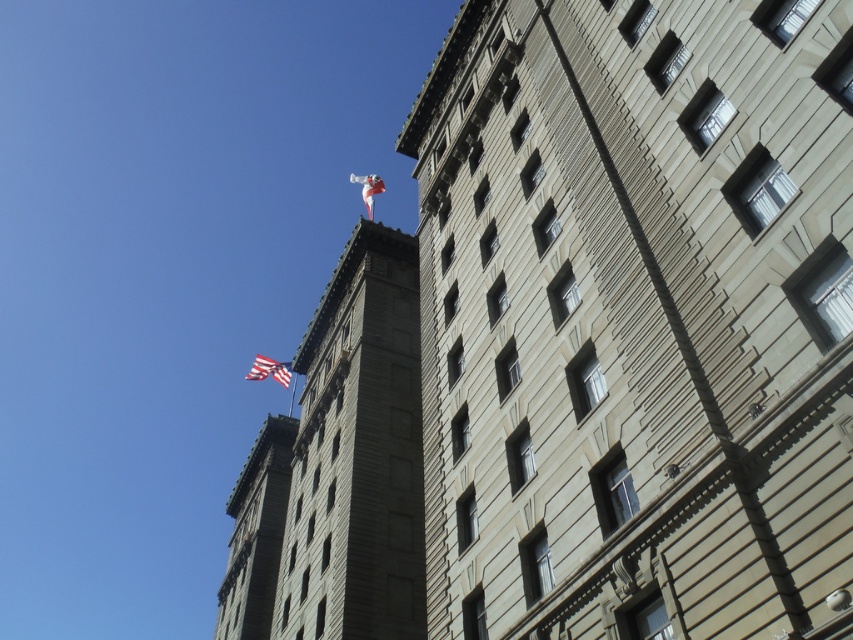
Question: Considering the real-world distances, which object is farthest from the red flag at upper left?

Choices:
 (A) white fabric flag at upper center
 (B) american flag at upper left
 (C) smooth stone tower at upper center

Answer: (A)

Question: Can you confirm if smooth stone tower at upper center is thinner than american flag at upper left?

Choices:
 (A) no
 (B) yes

Answer: (B)

Question: Does smooth stone building at center appear over red flag at upper left?

Choices:
 (A) yes
 (B) no

Answer: (A)

Question: Which object is the farthest from the smooth stone tower at upper center?

Choices:
 (A) american flag at upper left
 (B) white fabric flag at upper center

Answer: (A)

Question: Which object appears farthest from the camera in this image?

Choices:
 (A) smooth stone building at center
 (B) american flag at upper left
 (C) white fabric flag at upper center

Answer: (B)

Question: From the image, what is the correct spatial relationship of smooth stone tower at upper center in relation to american flag at upper left?

Choices:
 (A) below
 (B) above

Answer: (B)